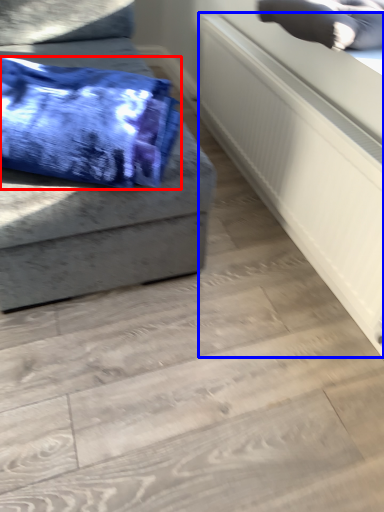
Question: Which object is closer to the camera taking this photo, blanket (highlighted by a red box) or radiator (highlighted by a blue box)?

Choices:
 (A) blanket
 (B) radiator

Answer: (A)